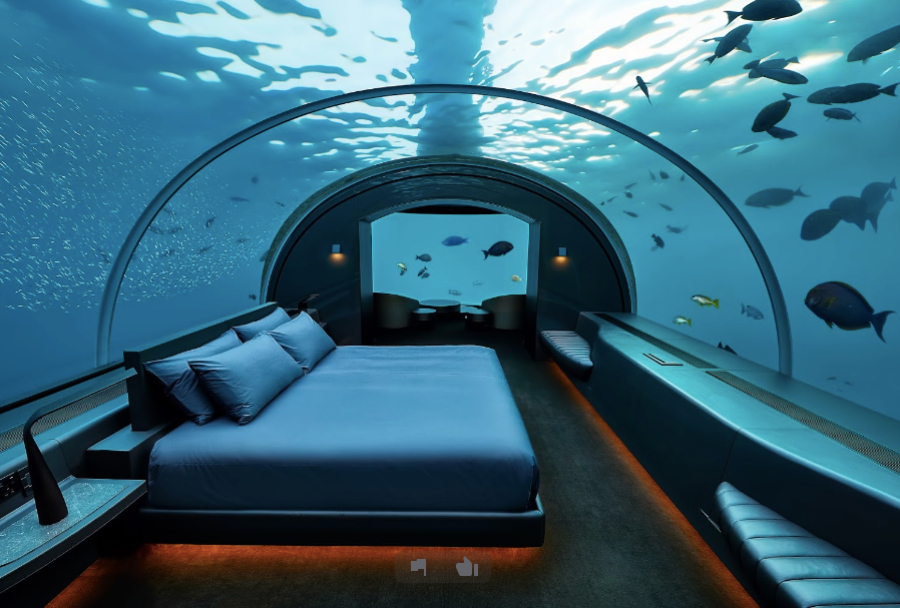
Find the location of a particular element. headboard is located at coordinates (192, 331).